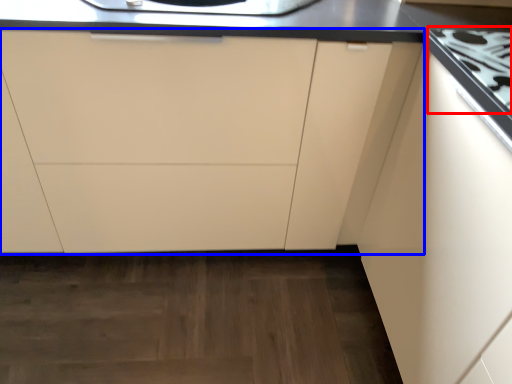
Question: Which point is further to the camera, gas stove (highlighted by a red box) or cabinetry (highlighted by a blue box)?

Choices:
 (A) gas stove
 (B) cabinetry

Answer: (B)